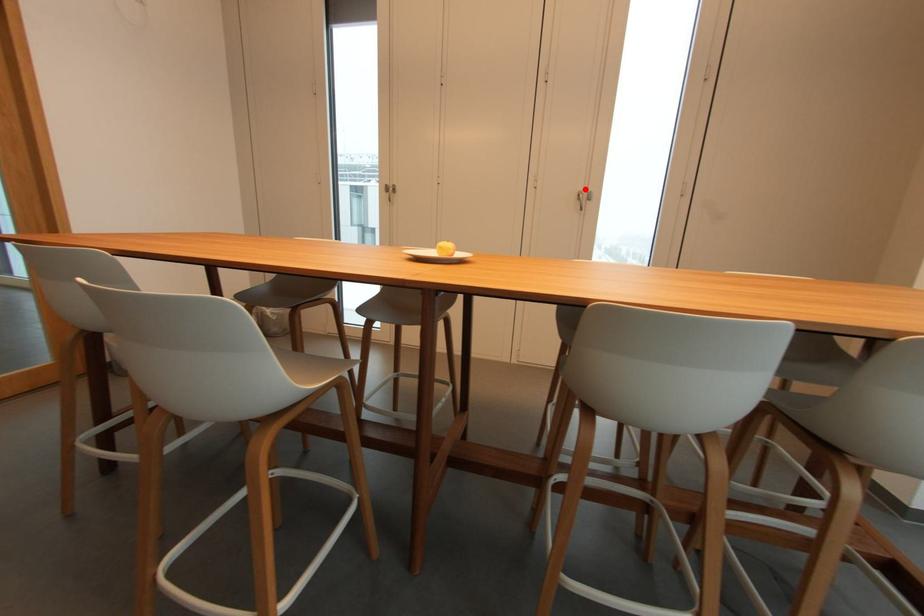
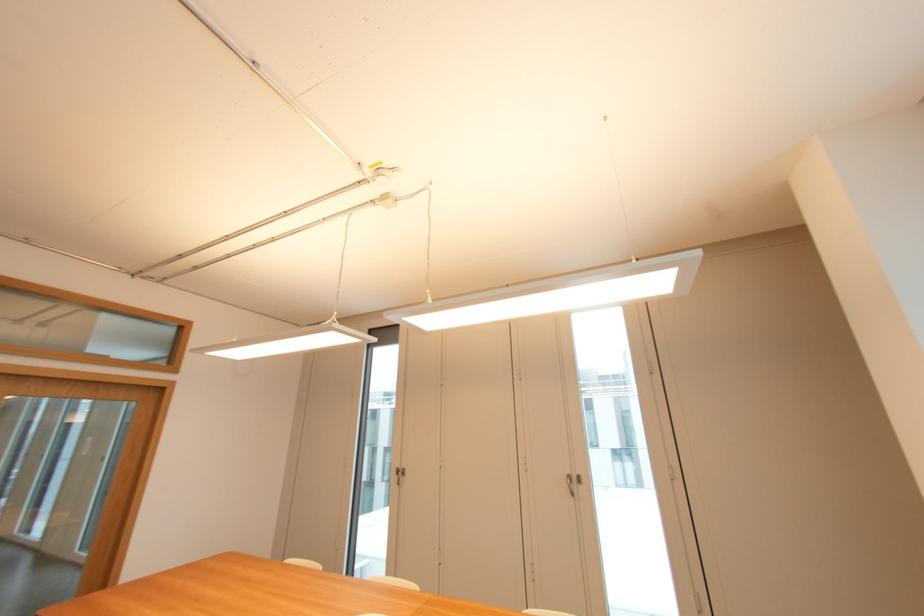
Question: I am providing you with two images of the same scene from different viewpoints. Given a red point in image1, look at the same physical point in image2. Is it:

Choices:
 (A) Closer to the viewpoint
 (B) Farther from the viewpoint

Answer: (B)